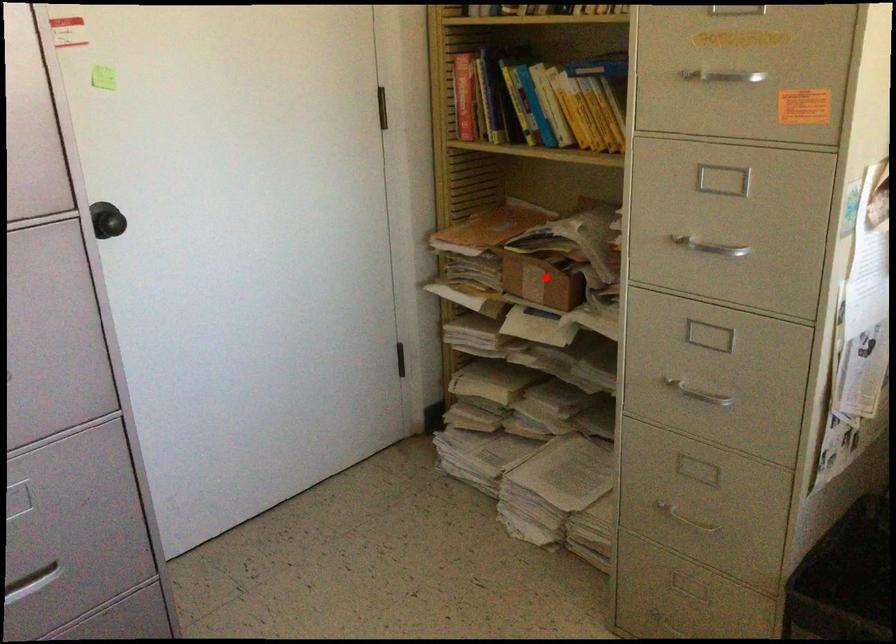
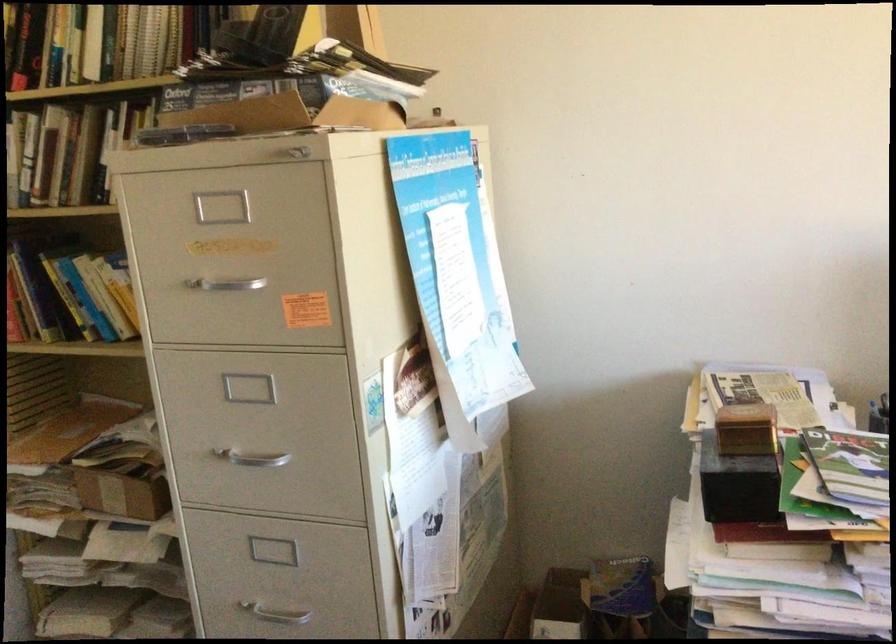
Question: I am providing you with two images of the same scene from different viewpoints. Image1 has a red point marked. In image2, the corresponding 3D location appears at what relative position? Reply with the corresponding letter.

Choices:
 (A) Closer
 (B) Farther

Answer: (A)